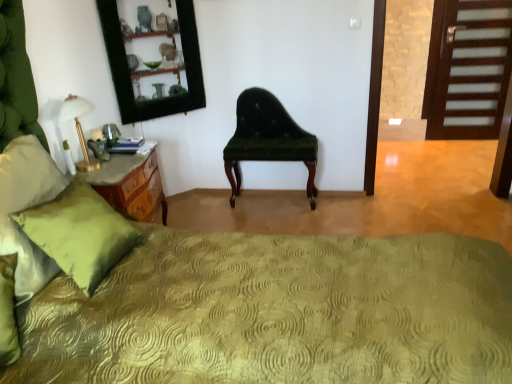
Identify the location of free point below dark wood door at right (from a real-world perspective). This screenshot has height=384, width=512. (455, 142).